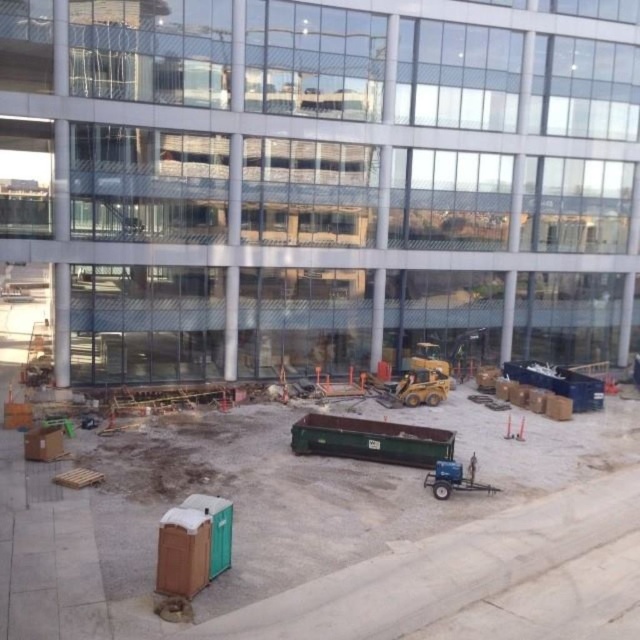
Who is more forward, (243, 90) or (1, 637)?

Point (1, 637)

Between point (346, 13) and point (22, 477), which one is positioned behind?

Positioned behind is point (346, 13).

What are the coordinates of `transparent glass building at center` in the screenshot? It's located at (321, 179).

Locate an element on the screen. Image resolution: width=640 pixels, height=640 pixels. green plastic container at lower center is located at coordinates (342, 538).

Is green plastic container at lower center bigger than blue metallic trailer at lower right?

Yes, green plastic container at lower center is bigger than blue metallic trailer at lower right.

Between point (524, 468) and point (456, 488), which one is positioned behind?

Positioned behind is point (524, 468).

The width and height of the screenshot is (640, 640). I want to click on green plastic container at lower center, so click(x=342, y=538).

Which is behind, point (304, 212) or point (433, 483)?

The point (304, 212) is behind.

Is point (488, 317) behind point (440, 467)?

That is True.

What do you see at coordinates (321, 179) in the screenshot? The width and height of the screenshot is (640, 640). I see `transparent glass building at center` at bounding box center [321, 179].

At what (x,y) coordinates should I click in order to perform the action: click on transparent glass building at center. Please return your answer as a coordinate pair (x, y). Looking at the image, I should click on (321, 179).